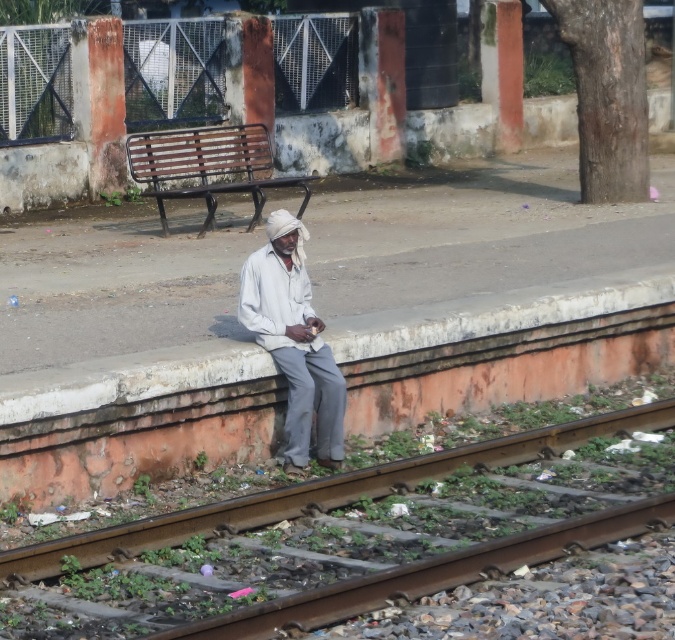
What do you see at coordinates (351, 536) in the screenshot?
I see `rusty metal train track at lower center` at bounding box center [351, 536].

Is point (402, 579) positioned before point (230, 188)?

That is True.

What are the coordinates of `rusty metal train track at lower center` in the screenshot? It's located at (351, 536).

Does rusty metal train track at lower center have a lesser width compared to white cotton shirt at center?

Incorrect, rusty metal train track at lower center's width is not less than white cotton shirt at center's.

Where is `rusty metal train track at lower center`? Image resolution: width=675 pixels, height=640 pixels. rusty metal train track at lower center is located at coordinates (351, 536).

What do you see at coordinates (294, 342) in the screenshot?
I see `white cotton shirt at center` at bounding box center [294, 342].

Measure the distance between point (315, 349) and camera.

Point (315, 349) and camera are 10.54 meters apart from each other.

Is point (288, 264) less distant than point (169, 148)?

Yes, it is.

The height and width of the screenshot is (640, 675). I want to click on white cotton shirt at center, so click(294, 342).